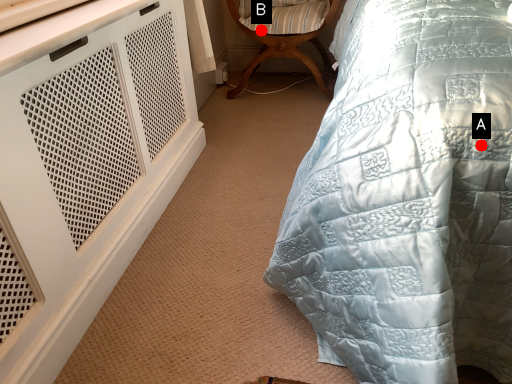
Question: Two points are circled on the image, labeled by A and B beside each circle. Which of the following is the closest to the observer?

Choices:
 (A) A is closer
 (B) B is closer

Answer: (A)